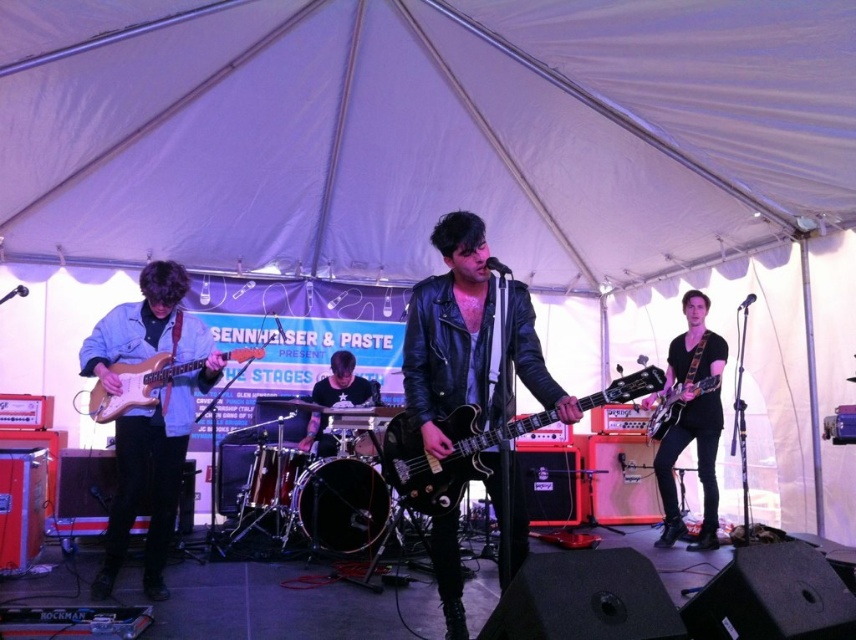
Which is in front, point (173, 355) or point (698, 433)?

Positioned in front is point (173, 355).

Can you confirm if denim jacket at left is positioned to the left of black leather guitar at right?

Correct, you'll find denim jacket at left to the left of black leather guitar at right.

Does point (171, 316) come farther from viewer compared to point (687, 340)?

No, (171, 316) is closer to viewer.

Where is `denim jacket at left`? The image size is (856, 640). denim jacket at left is located at coordinates (149, 413).

Can you confirm if denim jacket at left is shorter than shiny black electric guitar at center?

No.

Does denim jacket at left have a lesser width compared to shiny black electric guitar at center?

Correct, denim jacket at left's width is less than shiny black electric guitar at center's.

Locate an element on the screen. This screenshot has height=640, width=856. denim jacket at left is located at coordinates (149, 413).

Where is `denim jacket at left`? The height and width of the screenshot is (640, 856). denim jacket at left is located at coordinates (149, 413).

Is leather jacket at center above light brown wood electric guitar at left?

No, leather jacket at center is not above light brown wood electric guitar at left.

Who is shorter, leather jacket at center or light brown wood electric guitar at left?

Standing shorter between the two is light brown wood electric guitar at left.

The image size is (856, 640). What do you see at coordinates (468, 339) in the screenshot?
I see `leather jacket at center` at bounding box center [468, 339].

Locate an element on the screen. The height and width of the screenshot is (640, 856). leather jacket at center is located at coordinates (468, 339).